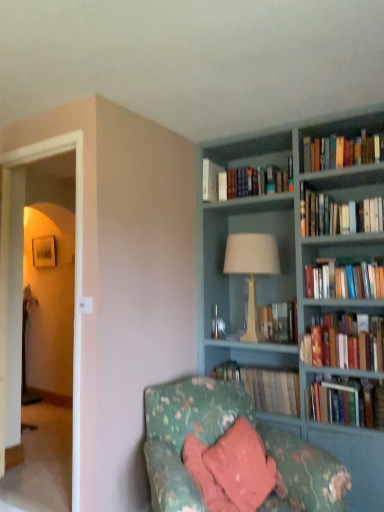
Question: Does white fabric lampshade at center have a greater width compared to hardcover book at center, the 8th book viewed from the top?

Choices:
 (A) no
 (B) yes

Answer: (B)

Question: Does white fabric lampshade at center have a lesser width compared to hardcover book at center, the 8th book viewed from the top?

Choices:
 (A) yes
 (B) no

Answer: (B)

Question: Considering the relative sizes of white fabric lampshade at center and hardcover book at center, the 8th book viewed from the top, in the image provided, is white fabric lampshade at center smaller than hardcover book at center, the 8th book viewed from the top,?

Choices:
 (A) yes
 (B) no

Answer: (B)

Question: From a real-world perspective, is white fabric lampshade at center positioned under hardcover book at center, the 8th book viewed from the top, based on gravity?

Choices:
 (A) no
 (B) yes

Answer: (A)

Question: From a real-world perspective, is white fabric lampshade at center on hardcover book at center, the 8th book viewed from the top?

Choices:
 (A) no
 (B) yes

Answer: (B)

Question: Is white fabric lampshade at center not within hardcover book at center, the 8th book viewed from the top?

Choices:
 (A) no
 (B) yes

Answer: (B)

Question: Are hardcover book at center, which ranks as the 2th book in bottom-to-top order, and hardcover book at right, the 7th book from the top, far apart?

Choices:
 (A) yes
 (B) no

Answer: (B)

Question: Does hardcover book at center, which ranks as the 2th book in bottom-to-top order, have a smaller size compared to hardcover book at right, the 7th book from the top?

Choices:
 (A) no
 (B) yes

Answer: (A)

Question: From a real-world perspective, is hardcover book at center, the 8th book viewed from the top, on top of hardcover book at right, the 7th book from the top?

Choices:
 (A) no
 (B) yes

Answer: (A)

Question: Is hardcover book at right, acting as the 3th book starting from the bottom, surrounded by hardcover book at center, which ranks as the 2th book in bottom-to-top order?

Choices:
 (A) no
 (B) yes

Answer: (A)

Question: Is hardcover book at center, the 8th book viewed from the top, wider than hardcover book at right, the 7th book from the top?

Choices:
 (A) no
 (B) yes

Answer: (B)

Question: Is hardcover book at center, the 8th book viewed from the top, positioned behind hardcover book at right, the 7th book from the top?

Choices:
 (A) no
 (B) yes

Answer: (B)

Question: Is floral fabric couch at lower right surrounding hardcover books at upper center, the 7th book from the bottom?

Choices:
 (A) yes
 (B) no

Answer: (B)